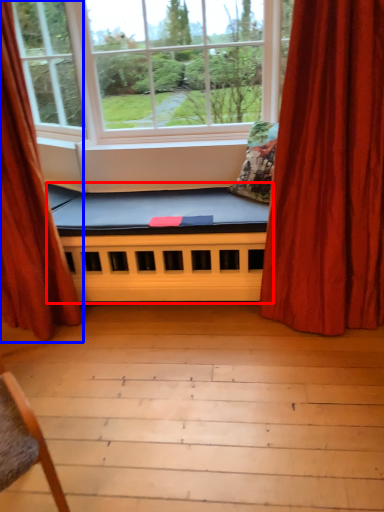
Question: Which point is closer to the camera, futon (highlighted by a red box) or curtain (highlighted by a blue box)?

Choices:
 (A) futon
 (B) curtain

Answer: (B)